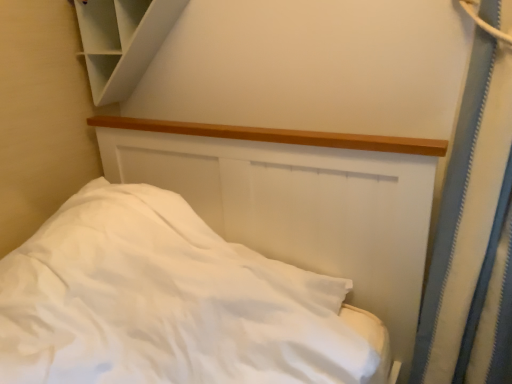
Question: Is white matte bed at center wider or thinner than white matte cabinet at upper left?

Choices:
 (A) wide
 (B) thin

Answer: (A)

Question: Considering the positions of point (418, 167) and point (125, 76), is point (418, 167) closer or farther from the camera than point (125, 76)?

Choices:
 (A) farther
 (B) closer

Answer: (B)

Question: Would you say white matte bed at center is inside or outside white matte cabinet at upper left?

Choices:
 (A) outside
 (B) inside

Answer: (A)

Question: Is point (156, 13) positioned closer to the camera than point (125, 144)?

Choices:
 (A) closer
 (B) farther

Answer: (A)

Question: From a real-world perspective, is white matte cabinet at upper left above or below white matte bed at center?

Choices:
 (A) below
 (B) above

Answer: (B)

Question: Is white matte cabinet at upper left inside or outside of white matte bed at center?

Choices:
 (A) inside
 (B) outside

Answer: (B)

Question: In terms of size, does white matte cabinet at upper left appear bigger or smaller than white matte bed at center?

Choices:
 (A) big
 (B) small

Answer: (B)